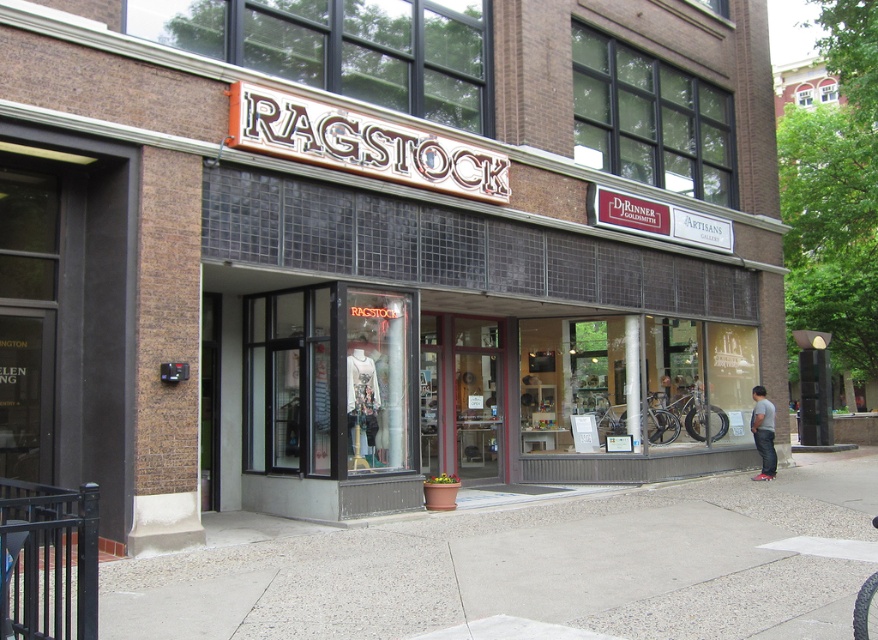
Question: Among these objects, which one is farthest from the camera?

Choices:
 (A) gray concrete pavement at center
 (B) gray cotton shirt at lower right

Answer: (B)

Question: Can you confirm if gray concrete pavement at center is bigger than gray cotton shirt at lower right?

Choices:
 (A) yes
 (B) no

Answer: (A)

Question: Is gray concrete pavement at center above gray cotton shirt at lower right?

Choices:
 (A) yes
 (B) no

Answer: (B)

Question: Which point is closer to the camera?

Choices:
 (A) gray cotton shirt at lower right
 (B) gray concrete pavement at center

Answer: (B)

Question: Does gray concrete pavement at center appear on the left side of gray cotton shirt at lower right?

Choices:
 (A) no
 (B) yes

Answer: (B)